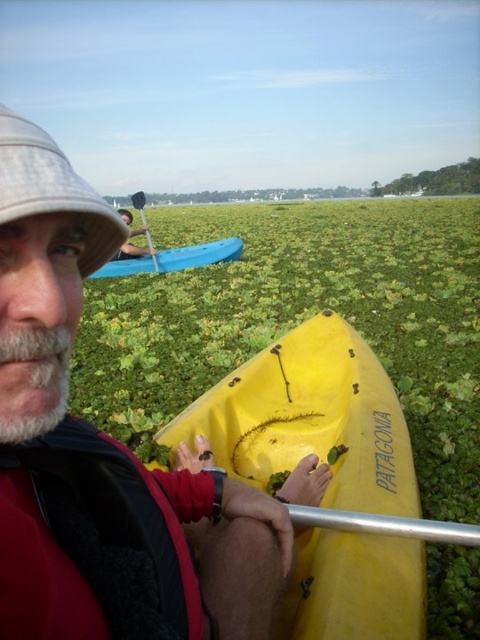
Question: Does matte yellow kayak at center have a greater width compared to matte blue kayak at upper left?

Choices:
 (A) yes
 (B) no

Answer: (B)

Question: Among these objects, which one is nearest to the camera?

Choices:
 (A) white fabric hat at upper left
 (B) blue plastic kayak at upper left
 (C) wooden paddle at center
 (D) matte blue kayak at upper left

Answer: (A)

Question: Does yellow matte kayak at lower center appear on the left side of wooden paddle at center?

Choices:
 (A) no
 (B) yes

Answer: (A)

Question: From the image, what is the correct spatial relationship of matte blue kayak at upper left in relation to wooden paddle at center?

Choices:
 (A) right
 (B) left

Answer: (A)

Question: Which point is farther to the camera?

Choices:
 (A) (136, 260)
 (B) (17, 141)
 (C) (248, 474)
 (D) (141, 205)

Answer: (D)

Question: Which object is closer to the camera taking this photo?

Choices:
 (A) matte blue kayak at upper left
 (B) white fabric hat at upper left
 (C) wooden paddle at center
 (D) matte yellow kayak at center

Answer: (B)